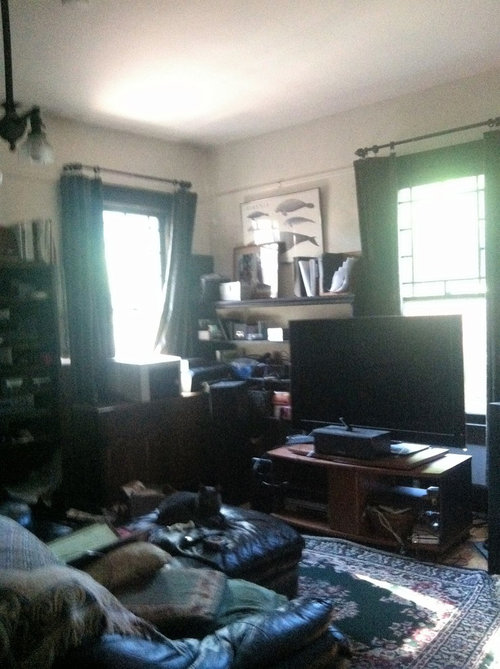
Where is `brown tv stand`? brown tv stand is located at coordinates (343, 476).